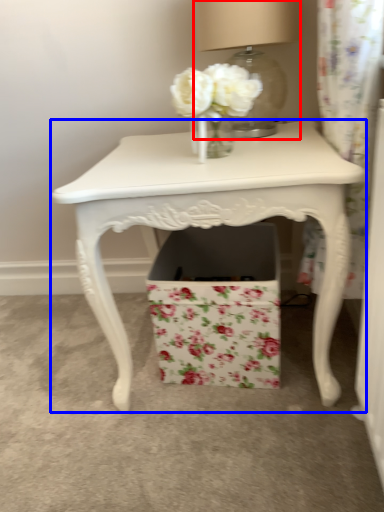
Question: Which object appears closest to the camera in this image, table lamp (highlighted by a red box) or table (highlighted by a blue box)?

Choices:
 (A) table lamp
 (B) table

Answer: (B)